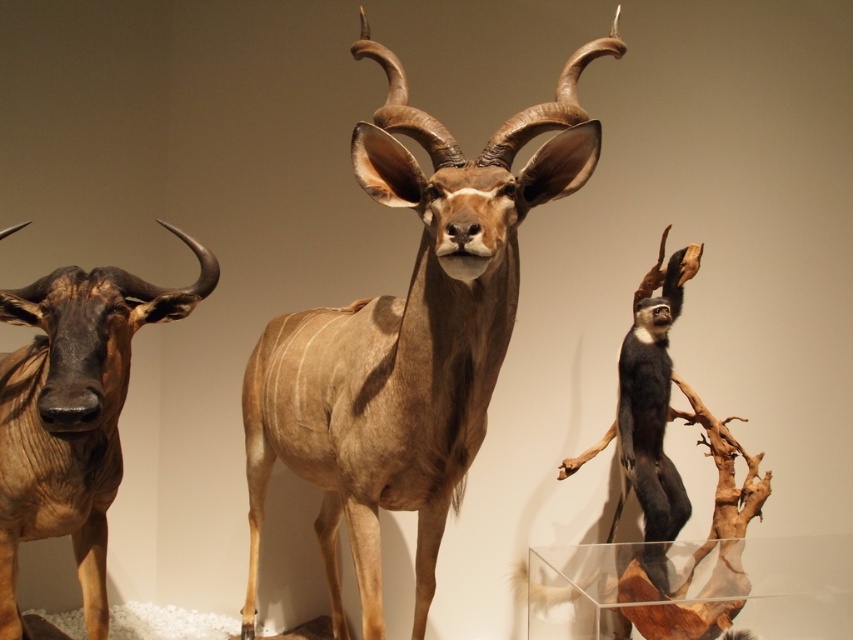
Does brown matte antelope at center have a lesser width compared to brown matte antelope at left?

No, brown matte antelope at center is not thinner than brown matte antelope at left.

Which is in front, point (346, 637) or point (4, 422)?

Point (4, 422) is in front.

Is point (579, 154) positioned after point (67, 369)?

Yes, it is behind point (67, 369).

The width and height of the screenshot is (853, 640). Identify the location of brown matte antelope at center. (408, 337).